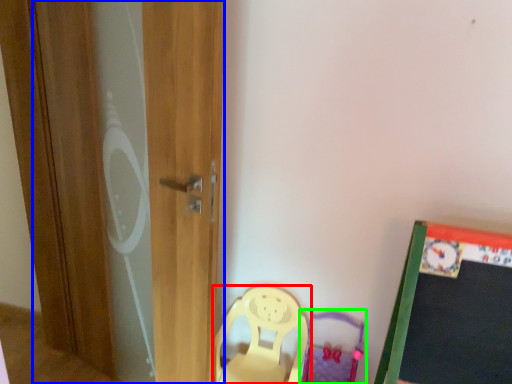
Question: Considering the real-world distances, which object is farthest from chair (highlighted by a red box)? screen door (highlighted by a blue box) or swivel chair (highlighted by a green box)?

Choices:
 (A) screen door
 (B) swivel chair

Answer: (A)